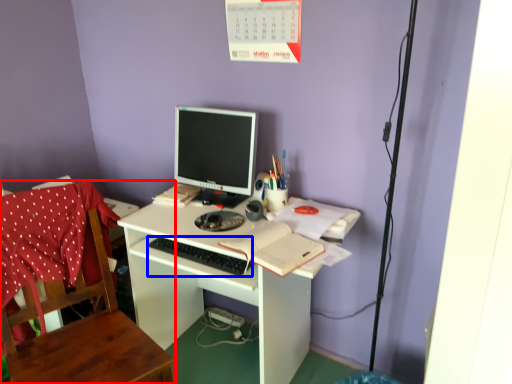
Question: Which point is further to the camera, chair (highlighted by a red box) or computer keyboard (highlighted by a blue box)?

Choices:
 (A) chair
 (B) computer keyboard

Answer: (B)